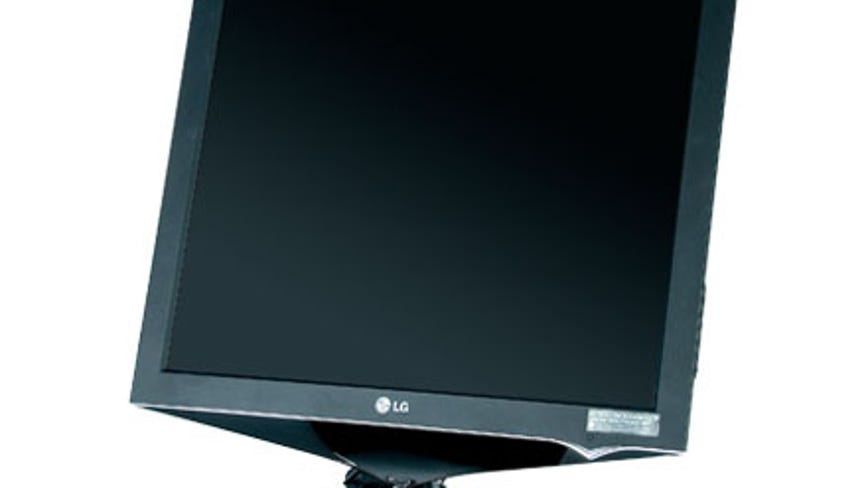
Identify the location of computer. The width and height of the screenshot is (868, 488). (521, 253).